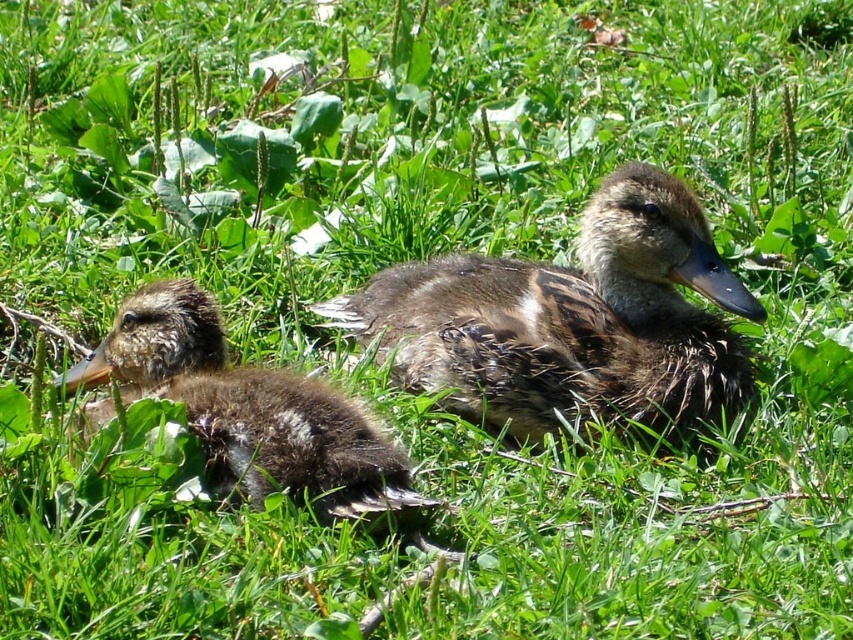
Question: Among these objects, which one is nearest to the camera?

Choices:
 (A) brown fuzzy duckling at center
 (B) brown fuzzy duckling at left

Answer: (B)

Question: Which point is farther to the camera?

Choices:
 (A) brown fuzzy duckling at center
 (B) brown fuzzy duckling at left

Answer: (A)

Question: Can you confirm if brown fuzzy duckling at center is positioned above brown fuzzy duckling at left?

Choices:
 (A) no
 (B) yes

Answer: (B)

Question: Does brown fuzzy duckling at center appear over brown fuzzy duckling at left?

Choices:
 (A) yes
 (B) no

Answer: (A)

Question: Is brown fuzzy duckling at center positioned at the back of brown fuzzy duckling at left?

Choices:
 (A) yes
 (B) no

Answer: (A)

Question: Which of the following is the closest to the observer?

Choices:
 (A) brown fuzzy duckling at left
 (B) brown fuzzy duckling at center

Answer: (A)